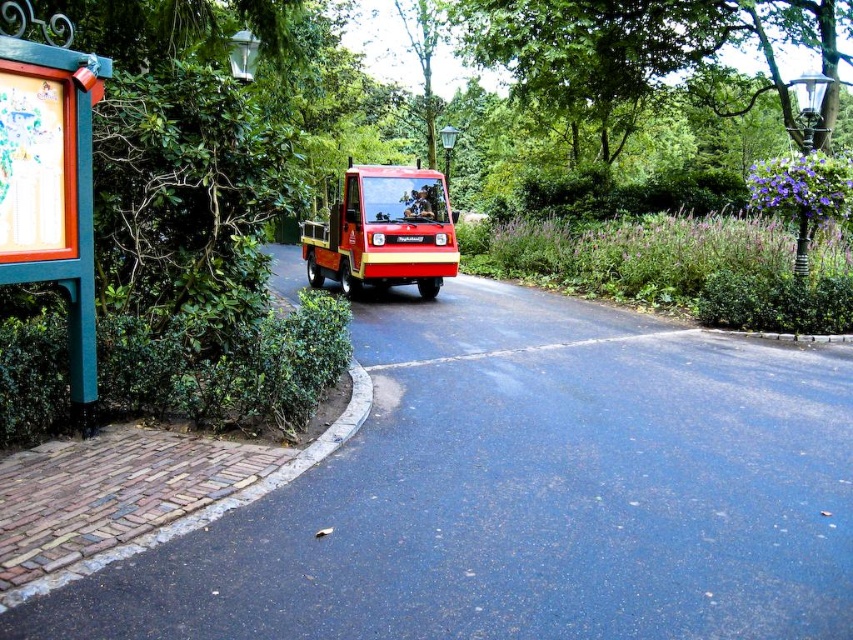
You are a pedestrian standing on the brick area near the wooden signboard at left and want to cross the road to reach the red matte utility vehicle at center. Which direction should you walk to get to the vehicle?

The wooden signboard at left is to the left of the red matte utility vehicle at center, so you should walk to the right to reach the vehicle.

You are standing at the center of the paved road and want to find the wooden signboard at left. Based on the scene, in which direction should you look to locate it?

The wooden signboard at left is located at the left side of the scene, so you should look to your left to find it.